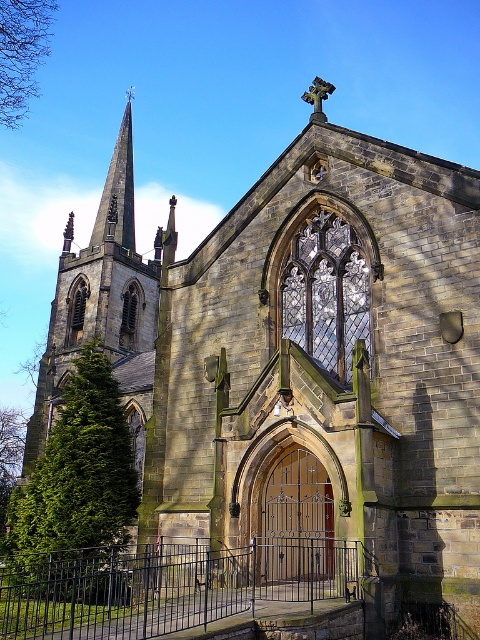
Question: Among these points, which one is farthest from the camera?

Choices:
 (A) (277, 588)
 (B) (108, 186)

Answer: (B)

Question: Is the position of black metal fence at center more distant than that of smooth stone spire at upper left?

Choices:
 (A) no
 (B) yes

Answer: (A)

Question: Does black metal fence at center have a lesser width compared to smooth stone spire at upper left?

Choices:
 (A) no
 (B) yes

Answer: (A)

Question: Among these objects, which one is nearest to the camera?

Choices:
 (A) black metal fence at center
 (B) smooth stone spire at upper left

Answer: (A)

Question: Can you confirm if black metal fence at center is smaller than smooth stone spire at upper left?

Choices:
 (A) yes
 (B) no

Answer: (A)